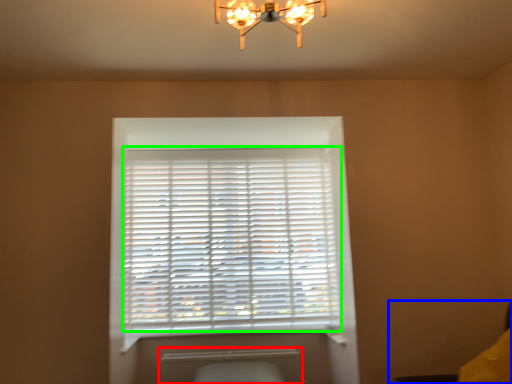
Question: Considering the real-world distances, which object is closest to radiator (highlighted by a red box)? swivel chair (highlighted by a blue box) or window blind (highlighted by a green box).

Choices:
 (A) swivel chair
 (B) window blind

Answer: (B)